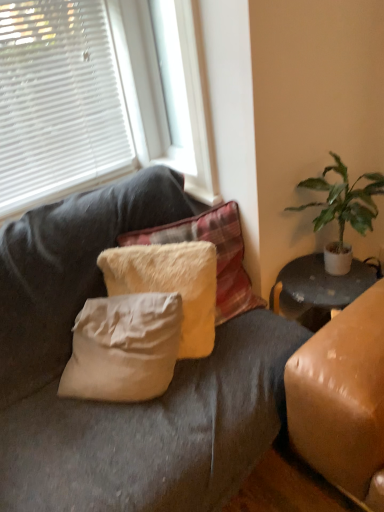
Question: Is fuzzy white pillow at center, acting as the second pillow starting from the top, to the left or to the right of white plastic window frame at upper center in the image?

Choices:
 (A) left
 (B) right

Answer: (A)

Question: Is point (114, 286) closer or farther from the camera than point (198, 181)?

Choices:
 (A) farther
 (B) closer

Answer: (B)

Question: Estimate the real-world distances between objects in this image. Which object is farther from the green leafy plant at right?

Choices:
 (A) white blinds at upper left
 (B) fuzzy white pillow at center, the 1th pillow positioned from the bottom
 (C) white plastic window frame at upper center
 (D) fuzzy white pillow at center, marked as the 2th pillow in a bottom-to-top arrangement

Answer: (A)

Question: Based on their relative distances, which object is farther from the white plastic window frame at upper center?

Choices:
 (A) fuzzy white pillow at center, acting as the 1th pillow starting from the top
 (B) green leafy plant at right
 (C) fuzzy white pillow at center, acting as the second pillow starting from the top
 (D) white blinds at upper left

Answer: (C)